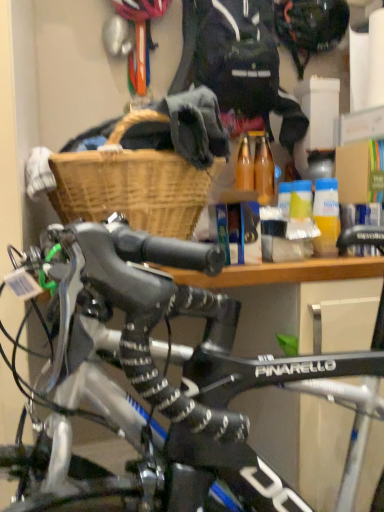
Measure the distance between point [329,205] and camera.

Point [329,205] is 3.43 feet away from camera.

Measure the distance between dark blue fabric jacket at upper center and camera.

A distance of 3.86 feet exists between dark blue fabric jacket at upper center and camera.

Find the location of a particular element. woven wood basket at upper center is located at coordinates (132, 189).

Is woven wood basket at upper center spatially inside yellow matte bottle at center, or outside of it?

woven wood basket at upper center is located beyond the bounds of yellow matte bottle at center.

Considering the positions of objects woven wood basket at upper center and yellow matte bottle at center in the image provided, who is more to the left, woven wood basket at upper center or yellow matte bottle at center?

Positioned to the left is woven wood basket at upper center.

Find the location of a particular element. The height and width of the screenshot is (512, 384). bottle beneath the woven wood basket at upper center (from a real-world perspective) is located at coordinates (326, 216).

Which object is further away from the camera taking this photo, dark blue fabric jacket at upper center or woven wood basket at upper center?

dark blue fabric jacket at upper center is further from the camera.

From a real-world perspective, is dark blue fabric jacket at upper center beneath woven wood basket at upper center?

No, from a real-world perspective, dark blue fabric jacket at upper center is not under woven wood basket at upper center.

How different are the orientations of dark blue fabric jacket at upper center and woven wood basket at upper center in degrees?

They differ by 0.00215 degrees in their facing directions.

Is woven wood basket at upper center inside dark blue fabric jacket at upper center?

That's incorrect, woven wood basket at upper center is not inside dark blue fabric jacket at upper center.

Which of these two, yellow matte bottle at center or woven wood basket at upper center, is bigger?

woven wood basket at upper center is bigger.

Which of these two, yellow matte bottle at center or woven wood basket at upper center, stands shorter?

yellow matte bottle at center.

Locate an element on the screen. This screenshot has height=512, width=384. bottle on the right of woven wood basket at upper center is located at coordinates (326, 216).

How much distance is there between black matte helmet at upper center and yellow matte bottle at center?

A distance of 28.42 inches exists between black matte helmet at upper center and yellow matte bottle at center.

Is black matte helmet at upper center aimed at yellow matte bottle at center?

No.

Does point (321, 2) come behind point (318, 215)?

Yes, it is behind point (318, 215).

From the image's perspective, which is above, black matte helmet at upper center or yellow matte bottle at center?

black matte helmet at upper center appears higher in the image.

Would you say black matte helmet at upper center is to the left or to the right of woven wood basket at upper center in the picture?

black matte helmet at upper center is positioned on woven wood basket at upper center's right side.

Between black matte helmet at upper center and woven wood basket at upper center, which one has less height?

Standing shorter between the two is black matte helmet at upper center.

Consider the image. Considering their positions, is black matte helmet at upper center located in front of or behind woven wood basket at upper center?

black matte helmet at upper center is positioned farther from the viewer than woven wood basket at upper center.

Is black matte helmet at upper center spatially inside woven wood basket at upper center, or outside of it?

black matte helmet at upper center is located beyond the bounds of woven wood basket at upper center.

Is woven wood basket at upper center bigger than dark blue fabric jacket at upper center?

Actually, woven wood basket at upper center might be smaller than dark blue fabric jacket at upper center.

Between woven wood basket at upper center and dark blue fabric jacket at upper center, which one appears on the left side from the viewer's perspective?

woven wood basket at upper center.

From their relative heights in the image, would you say woven wood basket at upper center is taller or shorter than dark blue fabric jacket at upper center?

Considering their sizes, woven wood basket at upper center has less height than dark blue fabric jacket at upper center.

Could black matte helmet at upper center be considered to be inside woven wood basket at upper center?

Actually, black matte helmet at upper center is outside woven wood basket at upper center.

Can you confirm if woven wood basket at upper center is wider than black matte helmet at upper center?

Correct, the width of woven wood basket at upper center exceeds that of black matte helmet at upper center.

Locate an element on the screen. basket on the left of yellow matte bottle at center is located at coordinates 132,189.

Where is `clothing that is above the woven wood basket at upper center (from a real-world perspective)`? clothing that is above the woven wood basket at upper center (from a real-world perspective) is located at coordinates (238, 62).

From the image, which object appears to be nearer to woven wood basket at upper center, black matte helmet at upper center or yellow matte bottle at center?

yellow matte bottle at center.

Looking at the image, which one is located closer to yellow matte bottle at center, woven wood basket at upper center or dark blue fabric jacket at upper center?

woven wood basket at upper center is closer to yellow matte bottle at center.

Based on the photo, considering their positions, is woven wood basket at upper center positioned closer to black matte helmet at upper center than dark blue fabric jacket at upper center?

dark blue fabric jacket at upper center.

Which object lies nearer to the anchor point woven wood basket at upper center, dark blue fabric jacket at upper center or yellow matte bottle at center?

yellow matte bottle at center lies closer to woven wood basket at upper center than the other object.

From the image, which object appears to be farther from dark blue fabric jacket at upper center, yellow matte bottle at center or black matte helmet at upper center?

yellow matte bottle at center is further to dark blue fabric jacket at upper center.

Estimate the real-world distances between objects in this image. Which object is closer to yellow matte bottle at center, dark blue fabric jacket at upper center or black matte helmet at upper center?

dark blue fabric jacket at upper center is closer to yellow matte bottle at center.

Based on their spatial positions, is dark blue fabric jacket at upper center or woven wood basket at upper center closer to black matte helmet at upper center?

dark blue fabric jacket at upper center is closer to black matte helmet at upper center.

Estimate the real-world distances between objects in this image. Which object is closer to black matte helmet at upper center, woven wood basket at upper center or yellow matte bottle at center?

Based on the image, yellow matte bottle at center appears to be nearer to black matte helmet at upper center.

Find the location of a particular element. This screenshot has height=512, width=384. clothing that lies between black matte helmet at upper center and yellow matte bottle at center from top to bottom is located at coordinates (238, 62).

This screenshot has width=384, height=512. I want to click on clothing that lies between black matte helmet at upper center and woven wood basket at upper center from top to bottom, so click(x=238, y=62).

The width and height of the screenshot is (384, 512). What are the coordinates of `basket between dark blue fabric jacket at upper center and yellow matte bottle at center in the vertical direction` in the screenshot? It's located at (132, 189).

Where is `basket between black matte helmet at upper center and yellow matte bottle at center vertically`? This screenshot has width=384, height=512. basket between black matte helmet at upper center and yellow matte bottle at center vertically is located at coordinates (x=132, y=189).